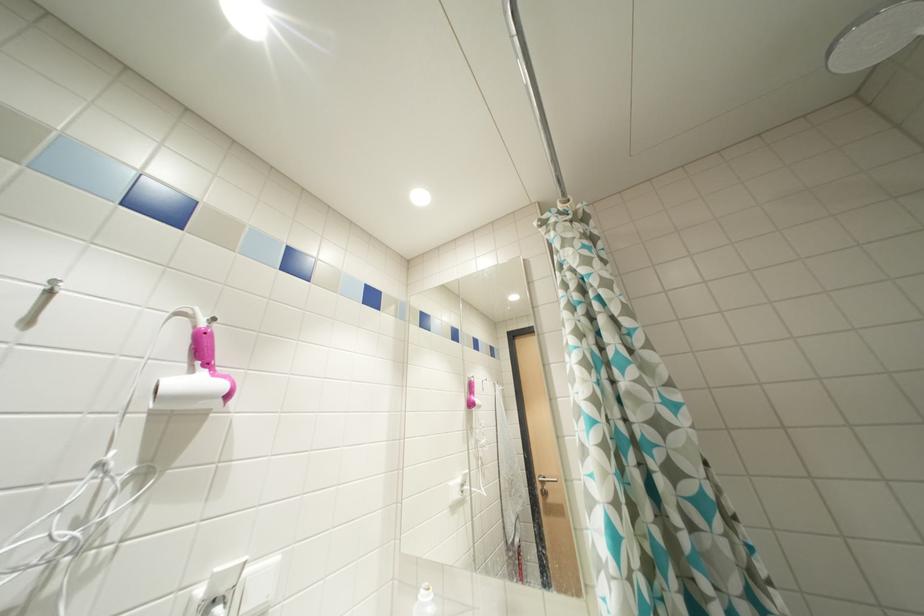
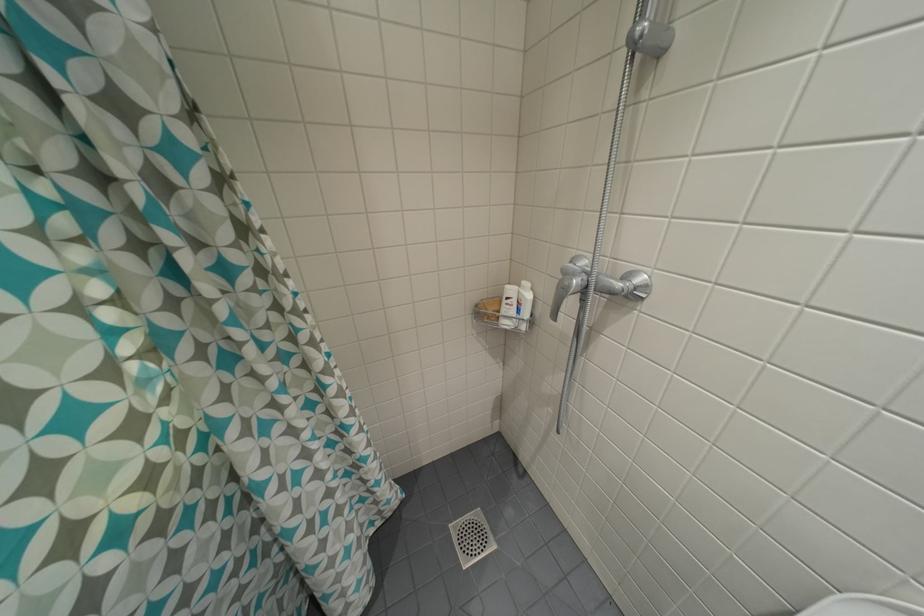
Consider the image. Based on the continuous images, in which direction is the camera rotating?

The rotation direction of the camera is right-down.